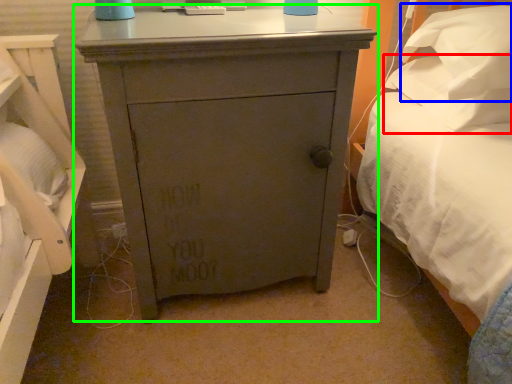
Question: Which object is the farthest from pillow (highlighted by a red box)? Choose among these: pillow (highlighted by a blue box) or chest of drawers (highlighted by a green box).

Choices:
 (A) pillow
 (B) chest of drawers

Answer: (B)